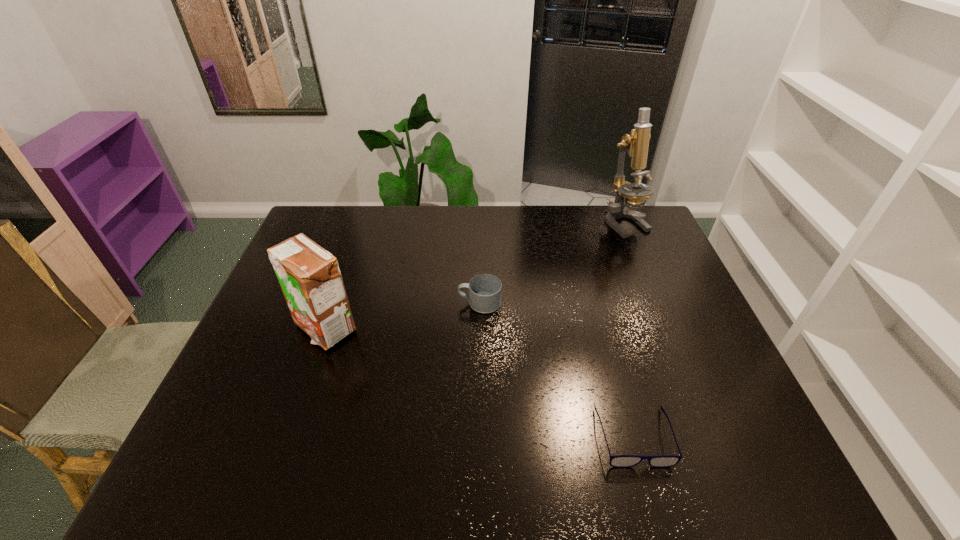
Identify the location of the rightmost object. (636, 143).

Locate an element on the screen. This screenshot has width=960, height=540. microscope is located at coordinates (636, 143).

The image size is (960, 540). In order to click on the leftmost object in this screenshot , I will do `click(309, 276)`.

Where is `carton`? This screenshot has height=540, width=960. carton is located at coordinates (309, 276).

Where is `the second shortest object`? the second shortest object is located at coordinates (485, 289).

Identify the location of the second object from left to right. (485, 289).

The width and height of the screenshot is (960, 540). In order to click on spectacles in this screenshot , I will do `click(620, 461)`.

Identify the location of the shortest object. (620, 461).

Image resolution: width=960 pixels, height=540 pixels. I want to click on free space located on the front of the farthest object, so click(650, 284).

Locate an element on the screen. The width and height of the screenshot is (960, 540). free location located 0.250m on the straw side of the third shortest object is located at coordinates (285, 443).